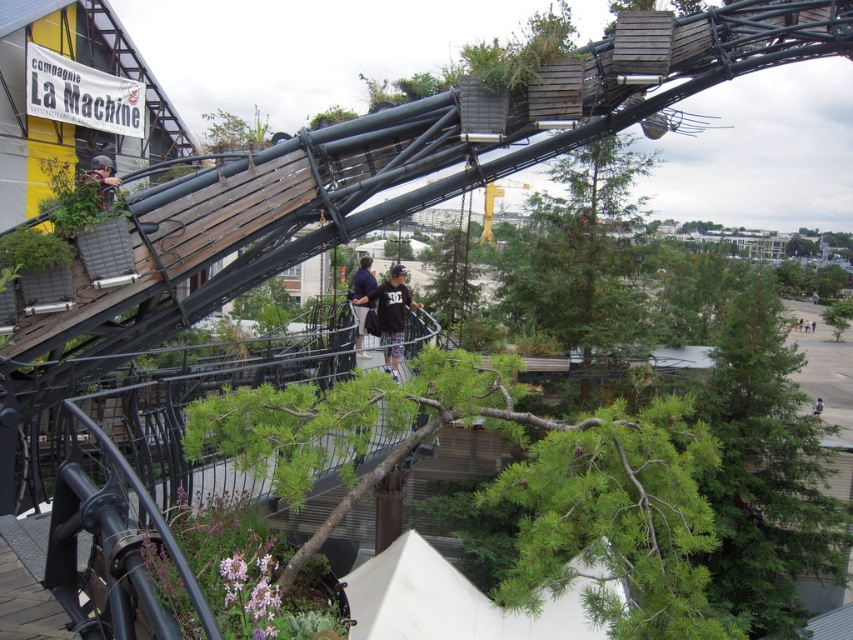
Can you confirm if green textured tree at upper right is positioned below black cotton shirt at center?

Correct, green textured tree at upper right is located below black cotton shirt at center.

Which of these two, green textured tree at upper right or black cotton shirt at center, stands taller?

With more height is green textured tree at upper right.

I want to click on green textured tree at upper right, so click(x=764, y=468).

Who is positioned more to the right, black cotton shirt at center or matte black helmet at upper left?

black cotton shirt at center

Consider the image. Who is taller, black cotton shirt at center or matte black helmet at upper left?

matte black helmet at upper left

Is point (393, 282) farther from viewer compared to point (102, 189)?

Yes, point (393, 282) is farther from viewer.

Identify the location of black cotton shirt at center. This screenshot has height=640, width=853. (392, 316).

You are a GUI agent. You are given a task and a screenshot of the screen. Output one action in this format:
    pyautogui.click(x=<x>, y=<y>)
    Task: Click on the green textured tree at upper right
    This screenshot has height=640, width=853.
    Given the screenshot: What is the action you would take?
    pyautogui.click(x=764, y=468)

Who is more forward, (776,618) or (819,410)?

Point (776,618) is more forward.

This screenshot has height=640, width=853. Identify the location of green textured tree at upper right. (764, 468).